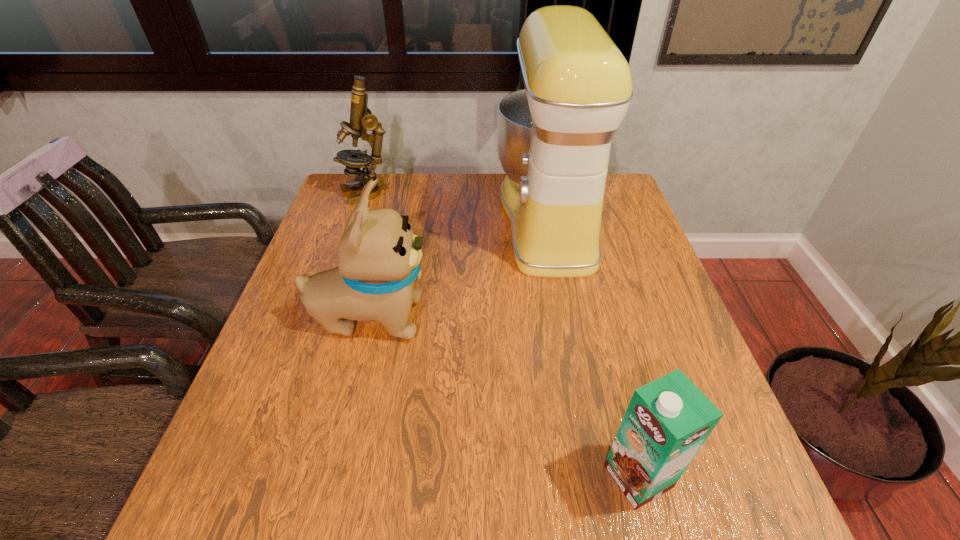
At what (x,y) coordinates should I click in order to perform the action: click on vacant area that lies between the mixer and the shortest object. Please return your answer as a coordinate pair (x, y). Looking at the image, I should click on (593, 348).

Identify the location of unoccupied area between the microscope and the mixer. (457, 206).

Find the location of a particular element. Image resolution: width=960 pixels, height=540 pixels. free spot between the carton and the puppy is located at coordinates (504, 397).

The image size is (960, 540). Identify the location of unoccupied position between the microscope and the tallest object. click(x=457, y=206).

At what (x,y) coordinates should I click in order to perform the action: click on object that stands as the third closest to the mixer. Please return your answer as a coordinate pair (x, y). The height and width of the screenshot is (540, 960). Looking at the image, I should click on (668, 420).

I want to click on object that is the third closest one to the tallest object, so click(668, 420).

What are the coordinates of `free region that satisfies the following two spatial constraints: 1. on the side of the tallest object with the control knob; 2. on the left side of the shortest object` in the screenshot? It's located at (598, 476).

The image size is (960, 540). Identify the location of vacant space that satisfies the following two spatial constraints: 1. on the side of the mixer with the control knob; 2. on the right side of the carton. coord(598,476).

Find the location of `vacant space that satisfies the following two spatial constraints: 1. on the side of the nearest object with the control knob; 2. on the left side of the mixer`. vacant space that satisfies the following two spatial constraints: 1. on the side of the nearest object with the control knob; 2. on the left side of the mixer is located at coordinates (598, 476).

This screenshot has width=960, height=540. Find the location of `vacant region that satisfies the following two spatial constraints: 1. on the back side of the carton; 2. on the side of the mixer with the control knob`. vacant region that satisfies the following two spatial constraints: 1. on the back side of the carton; 2. on the side of the mixer with the control knob is located at coordinates (571, 219).